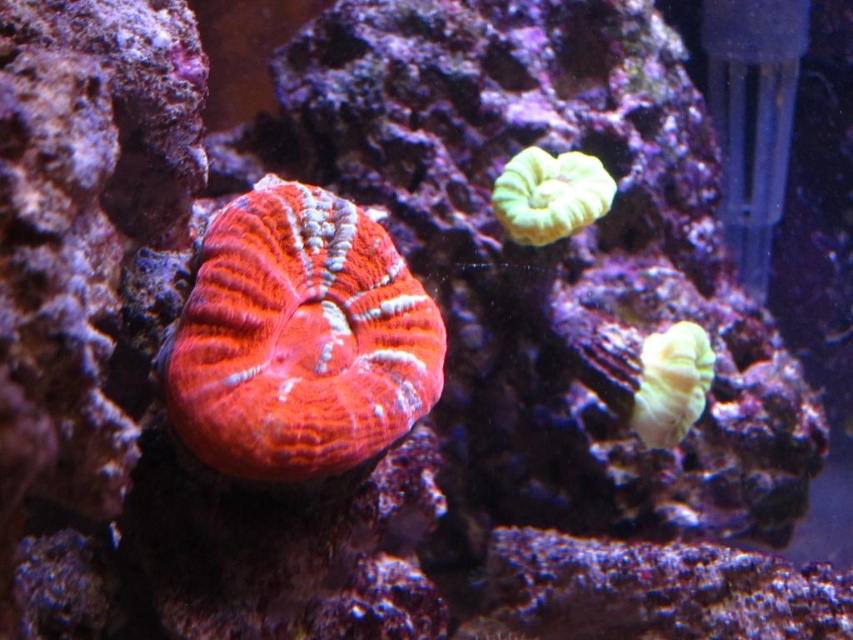
Is green matte coral at upper right bigger than yellow matte coral at right?

Yes.

Who is higher up, green matte coral at upper right or yellow matte coral at right?

green matte coral at upper right

This screenshot has width=853, height=640. In order to click on green matte coral at upper right in this screenshot , I will do `click(550, 195)`.

The height and width of the screenshot is (640, 853). I want to click on green matte coral at upper right, so click(x=550, y=195).

What do you see at coordinates (299, 339) in the screenshot?
I see `matte coral at center` at bounding box center [299, 339].

Is matte coral at center to the right of yellow matte coral at right from the viewer's perspective?

In fact, matte coral at center is to the left of yellow matte coral at right.

You are a GUI agent. You are given a task and a screenshot of the screen. Output one action in this format:
    pyautogui.click(x=<x>, y=<y>)
    Task: Click on the matte coral at center
    The height and width of the screenshot is (640, 853).
    Given the screenshot: What is the action you would take?
    pyautogui.click(x=299, y=339)

Does matte coral at center have a greater width compared to green matte coral at upper right?

Correct, the width of matte coral at center exceeds that of green matte coral at upper right.

Find the location of a particular element. This screenshot has width=853, height=640. matte coral at center is located at coordinates (299, 339).